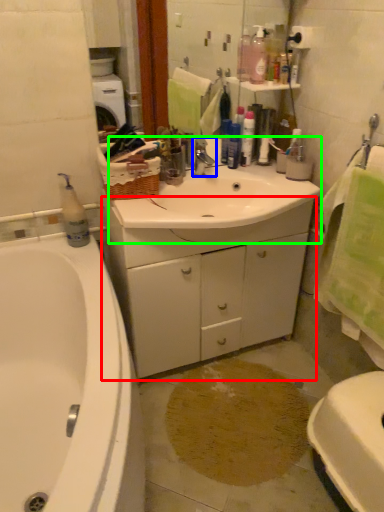
Question: Which object is positioned closest to cabinetry (highlighted by a red box)? Select from tap (highlighted by a blue box) and sink (highlighted by a green box).

Choices:
 (A) tap
 (B) sink

Answer: (B)